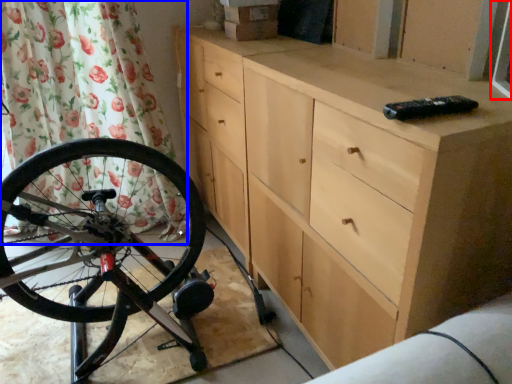
Question: Which object appears closest to the camera in this image, window screen (highlighted by a red box) or shower curtain (highlighted by a blue box)?

Choices:
 (A) window screen
 (B) shower curtain

Answer: (A)